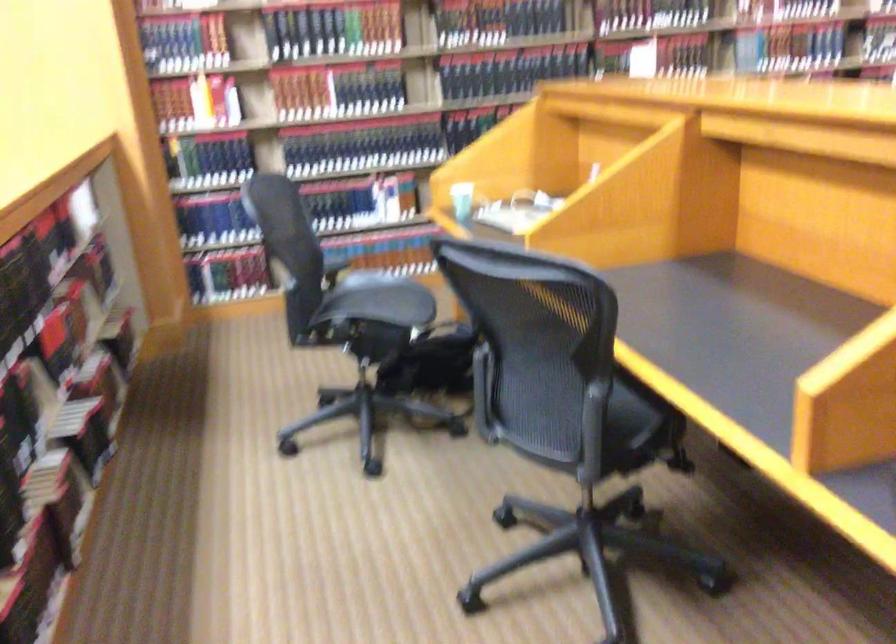
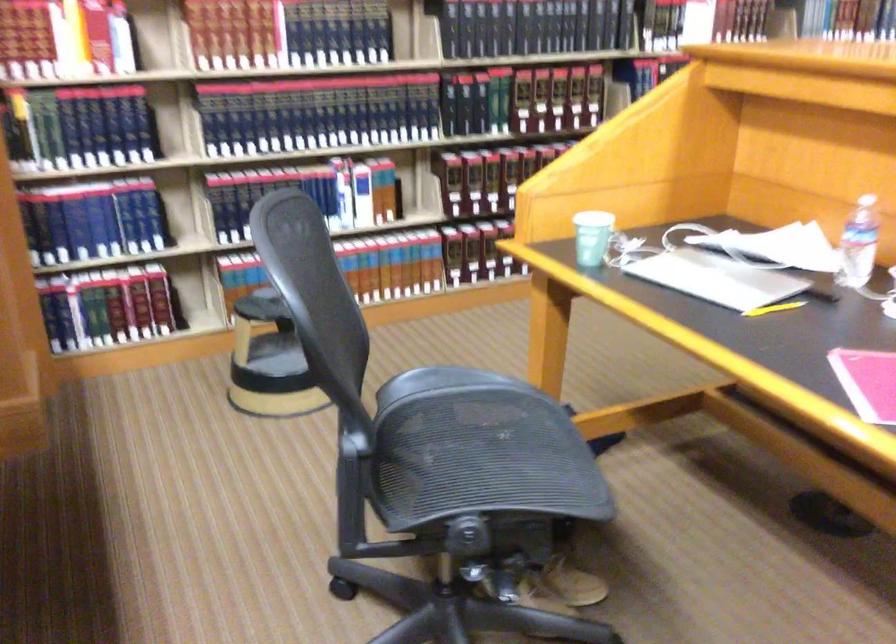
Find the pixel in the second image that matches pixel 371 301 in the first image.

(470, 442)